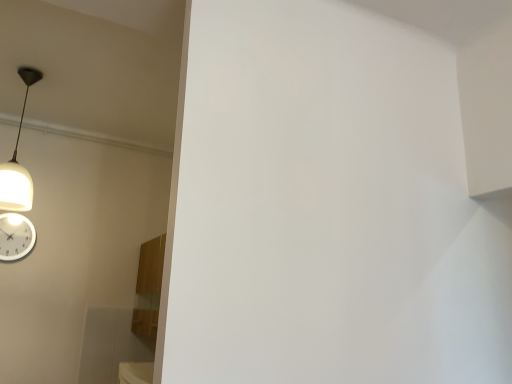
Question: Do you think white glossy wall clock at lower left is within white matte lampshade at upper left, or outside of it?

Choices:
 (A) outside
 (B) inside

Answer: (A)

Question: Considering the positions of white glossy wall clock at lower left and white matte lampshade at upper left in the image, is white glossy wall clock at lower left wider or thinner than white matte lampshade at upper left?

Choices:
 (A) wide
 (B) thin

Answer: (B)

Question: Considering the relative positions of white glossy wall clock at lower left and white matte lampshade at upper left in the image provided, is white glossy wall clock at lower left to the left or to the right of white matte lampshade at upper left?

Choices:
 (A) right
 (B) left

Answer: (B)

Question: Does point (1, 180) appear closer or farther from the camera than point (15, 215)?

Choices:
 (A) farther
 (B) closer

Answer: (B)

Question: Is white matte lampshade at upper left to the left or to the right of white glossy wall clock at lower left in the image?

Choices:
 (A) right
 (B) left

Answer: (A)

Question: Considering the positions of white matte lampshade at upper left and white glossy wall clock at lower left in the image, is white matte lampshade at upper left bigger or smaller than white glossy wall clock at lower left?

Choices:
 (A) small
 (B) big

Answer: (B)

Question: Do you think white matte lampshade at upper left is within white glossy wall clock at lower left, or outside of it?

Choices:
 (A) inside
 (B) outside

Answer: (B)